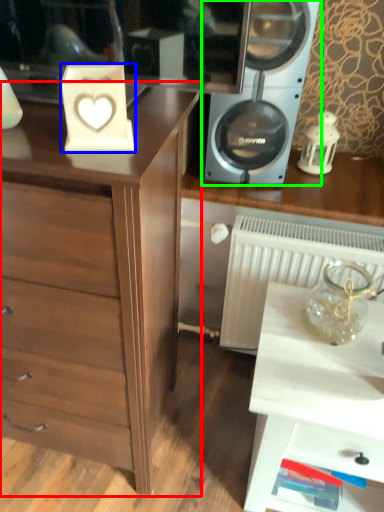
Question: Considering the real-world distances, which object is farthest from chest of drawers (highlighted by a red box)? appliance (highlighted by a blue box) or home appliance (highlighted by a green box)?

Choices:
 (A) appliance
 (B) home appliance

Answer: (B)